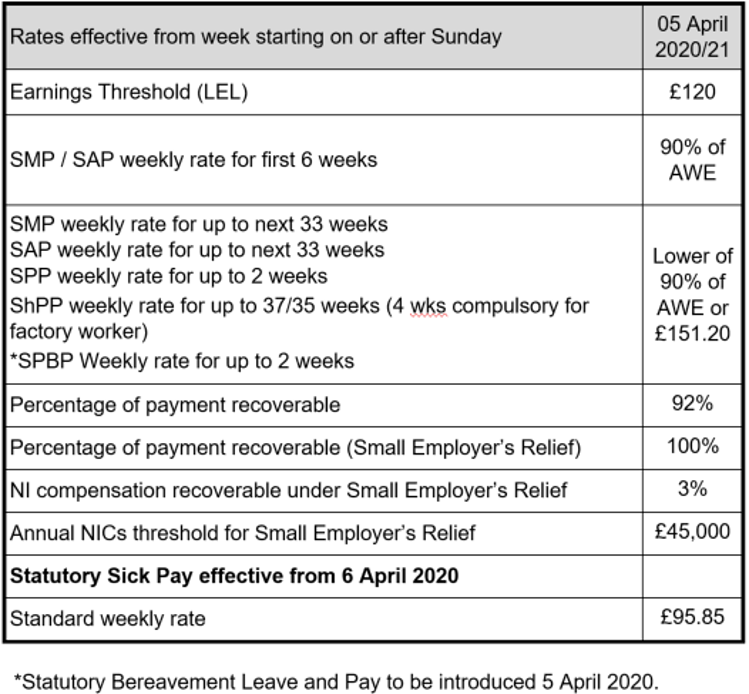
This screenshot has width=749, height=694. I want to click on table, so click(x=449, y=257).